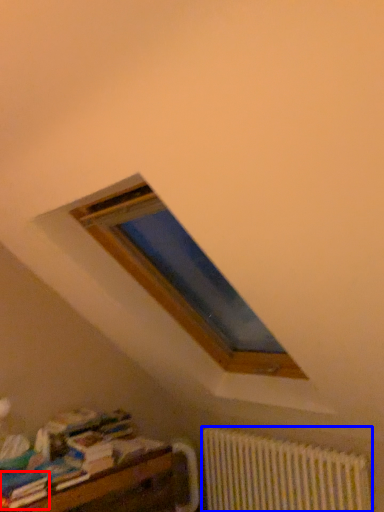
Question: Which of the following is the closest to the observer, paperback book (highlighted by a red box) or radiator (highlighted by a blue box)?

Choices:
 (A) paperback book
 (B) radiator

Answer: (A)